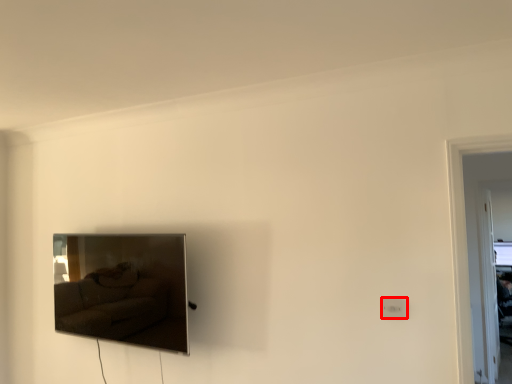
Question: Where is electric outlet (annotated by the red box) located in relation to picture frame in the image?

Choices:
 (A) right
 (B) left

Answer: (A)